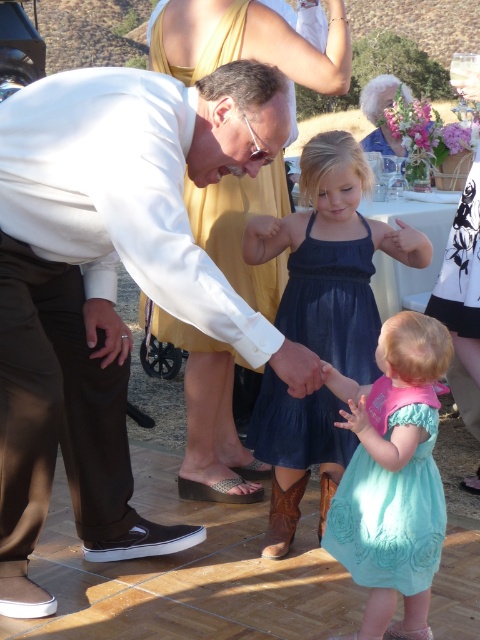
Which of these two, white leather shoes at center or teal satin dress at center, stands shorter?

With less height is teal satin dress at center.

Which is below, white leather shoes at center or teal satin dress at center?

teal satin dress at center is below.

This screenshot has height=640, width=480. What are the coordinates of `white leather shoes at center` in the screenshot? It's located at (130, 273).

Describe the element at coordinates (393, 477) in the screenshot. This screenshot has width=480, height=640. I see `teal satin dress at center` at that location.

This screenshot has width=480, height=640. Identify the location of teal satin dress at center. (393, 477).

Is point (397, 365) closer to viewer compared to point (313, 419)?

Yes.

Identify the location of teal satin dress at center. The width and height of the screenshot is (480, 640). (393, 477).

Does white leather shoes at center have a greater width compared to dark blue dress at center?

Indeed, white leather shoes at center has a greater width compared to dark blue dress at center.

Does white leather shoes at center come behind dark blue dress at center?

No, white leather shoes at center is in front of dark blue dress at center.

Is point (302, 394) closer to camera compared to point (267, 376)?

Yes, it is in front of point (267, 376).

Locate an element on the screen. This screenshot has height=640, width=480. white leather shoes at center is located at coordinates (130, 273).